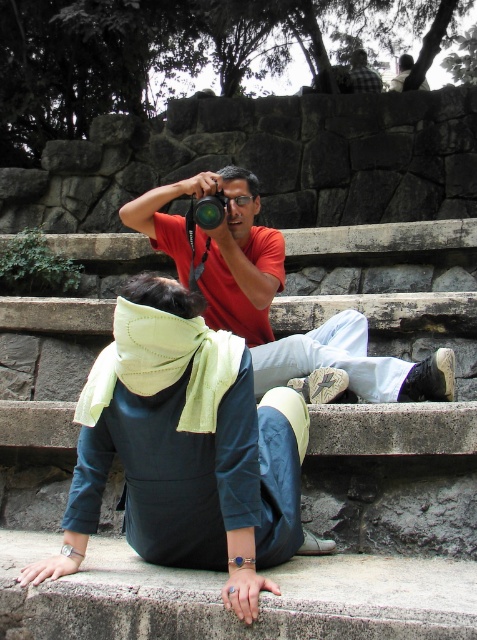
You are a photographer trying to capture a candid shot of the person in the matte red shirt at center without them noticing. The matte black camera at center is positioned between you and your subject. Based on their current positions, can you take the photo without the person noticing?

The matte red shirt at center is in front of the matte black camera at center, so the person wearing the matte red shirt at center would block your view of the camera. Therefore, you cannot take the photo without them noticing because they are directly in front of the camera.

You are trying to decide whether to place a new small decorative item on the stone steps where the matte red shirt at center and the matte black camera at center are located. Based on their sizes, which object would allow more space for the new item next to it?

The matte black camera at center is smaller in size than the matte red shirt at center, so placing the new item next to the matte black camera at center would leave more space available.

You are standing at the origin point of the coordinate system in the image. The person wearing the matte red shirt at center is at position 0.463 on the x and 0.572 on the y. If you want to move directly towards them, in which direction should you move first?

The matte red shirt at center is located at coordinates x 0.463 and y 0.572. Since you are at the origin, you should move right along the x axis and up along the y axis to reach them.